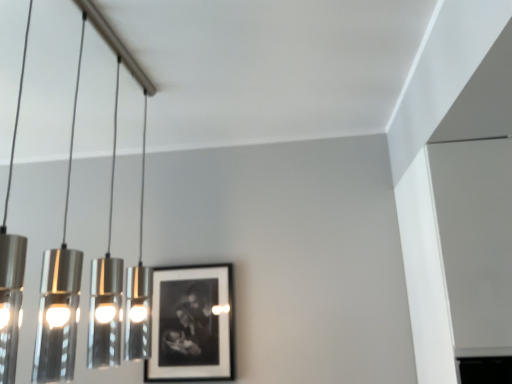
What do you see at coordinates (192, 324) in the screenshot?
I see `black matte picture frame at center` at bounding box center [192, 324].

Where is `black matte picture frame at center`? black matte picture frame at center is located at coordinates (192, 324).

What do you see at coordinates (12, 261) in the screenshot? I see `polished silver pendant lights at left` at bounding box center [12, 261].

Locate an element on the screen. This screenshot has width=512, height=384. polished silver pendant lights at left is located at coordinates (12, 261).

What is the approximate width of polished silver pendant lights at left?

polished silver pendant lights at left is 5.94 inches in width.

Measure the distance between polished silver pendant lights at left and camera.

The distance of polished silver pendant lights at left from camera is 6.61 feet.

The height and width of the screenshot is (384, 512). In order to click on black matte picture frame at center in this screenshot , I will do `click(192, 324)`.

Is polished silver pendant lights at left to the left or to the right of black matte picture frame at center in the image?

polished silver pendant lights at left is to the left of black matte picture frame at center.

Which object is further away from the camera, polished silver pendant lights at left or black matte picture frame at center?

black matte picture frame at center is behind.

Which point is more distant from viewer, (16, 269) or (188, 377)?

Point (16, 269)

From the image's perspective, which one is positioned lower, polished silver pendant lights at left or black matte picture frame at center?

black matte picture frame at center is shown below in the image.

In the scene shown: From a real-world perspective, is polished silver pendant lights at left located higher than black matte picture frame at center?

Yes, from a real-world perspective, polished silver pendant lights at left is on top of black matte picture frame at center.

Looking at this image, which object is wider, polished silver pendant lights at left or black matte picture frame at center?

With larger width is polished silver pendant lights at left.

Between polished silver pendant lights at left and black matte picture frame at center, which one has less height?

black matte picture frame at center is shorter.

Which of these two, polished silver pendant lights at left or black matte picture frame at center, is bigger?

With larger size is polished silver pendant lights at left.

Is polished silver pendant lights at left not within black matte picture frame at center?

That's correct, polished silver pendant lights at left is outside of black matte picture frame at center.

Is polished silver pendant lights at left directly adjacent to black matte picture frame at center?

No, polished silver pendant lights at left is not with black matte picture frame at center.

Is polished silver pendant lights at left facing away from black matte picture frame at center?

No, polished silver pendant lights at left is not facing away from black matte picture frame at center.

Can you tell me how much polished silver pendant lights at left and black matte picture frame at center differ in facing direction?

They differ by 90.3 degrees in their facing directions.

Find the location of a particular element. Image resolution: width=512 pixels, height=384 pixels. lamp in front of the black matte picture frame at center is located at coordinates (12, 261).

Visually, is black matte picture frame at center positioned to the left or to the right of polished silver pendant lights at left?

black matte picture frame at center is to the right of polished silver pendant lights at left.

In the image, is black matte picture frame at center positioned in front of or behind polished silver pendant lights at left?

Visually, black matte picture frame at center is located behind polished silver pendant lights at left.

Considering the points (148, 374) and (60, 369), which point is behind, point (148, 374) or point (60, 369)?

The point (60, 369) is more distant.

From the image's perspective, relative to polished silver pendant lights at left, is black matte picture frame at center above or below?

Based on their image positions, black matte picture frame at center is located beneath polished silver pendant lights at left.

From a real-world perspective, between black matte picture frame at center and polished silver pendant lights at left, who is vertically lower?

black matte picture frame at center is physically lower.

Does black matte picture frame at center have a lesser width compared to polished silver pendant lights at left?

Correct, the width of black matte picture frame at center is less than that of polished silver pendant lights at left.

Which of these two, black matte picture frame at center or polished silver pendant lights at left, stands shorter?

black matte picture frame at center.

Does black matte picture frame at center have a smaller size compared to polished silver pendant lights at left?

Correct, black matte picture frame at center occupies less space than polished silver pendant lights at left.

Is polished silver pendant lights at left inside black matte picture frame at center?

No, polished silver pendant lights at left is located outside of black matte picture frame at center.

Would you say black matte picture frame at center is a long distance from polished silver pendant lights at left?

They are positioned close to each other.

Could you tell me if black matte picture frame at center is turned towards polished silver pendant lights at left?

Yes, black matte picture frame at center is turned towards polished silver pendant lights at left.

Looking at this image, how many degrees apart are the facing directions of black matte picture frame at center and polished silver pendant lights at left?

There is a 90.3-degree angle between the facing directions of black matte picture frame at center and polished silver pendant lights at left.

Measure the distance from black matte picture frame at center to polished silver pendant lights at left.

black matte picture frame at center and polished silver pendant lights at left are 22.91 inches apart.

Locate an element on the screen. lamp in front of the black matte picture frame at center is located at coordinates (12, 261).

In order to click on picture frame below the polished silver pendant lights at left (from the image's perspective) in this screenshot , I will do `click(192, 324)`.

Locate an element on the screen. picture frame behind the polished silver pendant lights at left is located at coordinates (192, 324).